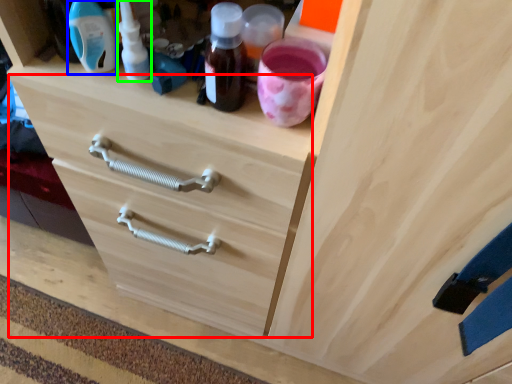
Question: Considering the real-world distances, which object is closest to drawer (highlighted by a red box)? bottle (highlighted by a blue box) or bottle (highlighted by a green box).

Choices:
 (A) bottle
 (B) bottle

Answer: (B)